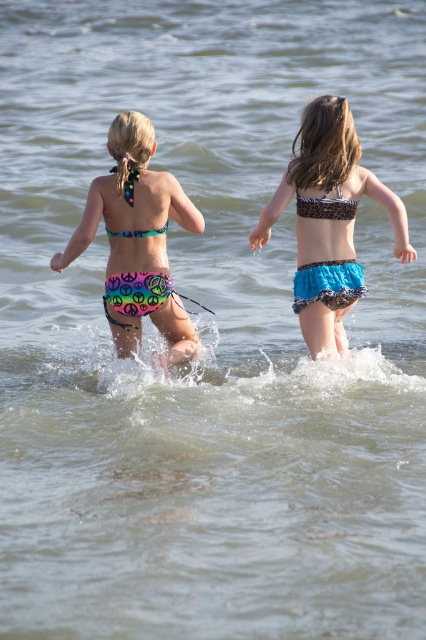
You are a photographer trying to capture both the rainbow fabric bikini at center and the peace sign print bikini at center in a single shot. Based on their positions, which bikini is positioned to the left side of the other?

The rainbow fabric bikini at center is to the left of the peace sign print bikini at center.

You are a photographer trying to capture both the rainbow fabric bikini at center and the peace sign print bikini at center in a single shot. Since you want to ensure both are clearly visible, which bikini should you focus on first to ensure it doesn

The rainbow fabric bikini at center is bigger than the peace sign print bikini at center, so you should focus on the rainbow fabric bikini at center first to ensure it is clearly visible before adjusting for the smaller one.

You are a photographer trying to capture both the rainbow fabric bikini at center and the blue textured bikini at center in a single frame. Since you want to ensure both are fully visible, which bikini should you focus on to avoid cropping the other?

The rainbow fabric bikini at center is wider than the blue textured bikini at center. Therefore, you should focus on framing the rainbow fabric bikini at center first to ensure the narrower blue textured bikini at center fits into the shot without being cropped.